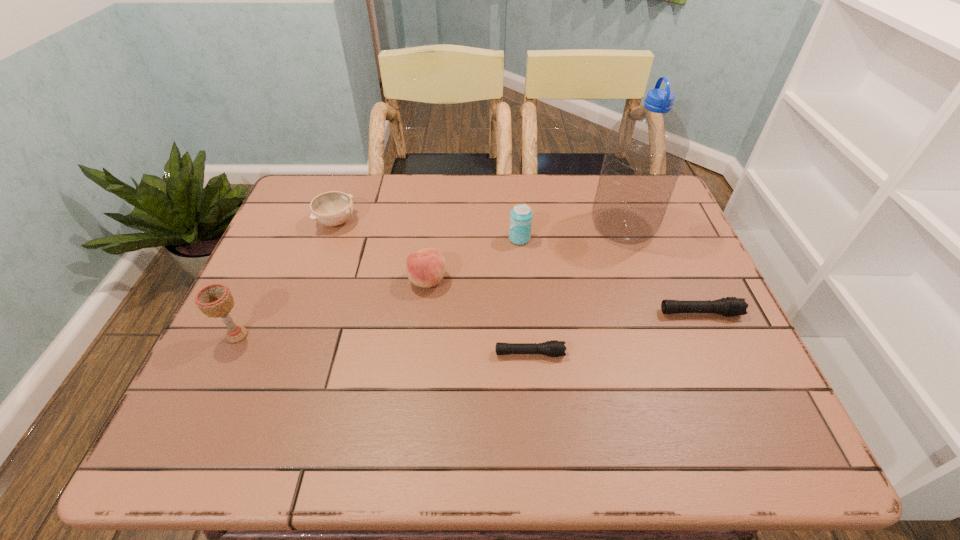
The height and width of the screenshot is (540, 960). I want to click on the fifth object from right to left, so click(x=425, y=268).

Locate an element on the screen. The height and width of the screenshot is (540, 960). the fourth farthest object is located at coordinates (425, 268).

Find the location of `free space located 0.360m at the lens end of the shortest object`. free space located 0.360m at the lens end of the shortest object is located at coordinates (730, 353).

I want to click on free location located on the front of the sixth object from right to left, so click(291, 348).

You are a GUI agent. You are given a task and a screenshot of the screen. Output one action in this format:
    pyautogui.click(x=<x>, y=<y>)
    Task: Click on the free space located 0.290m on the front of the beer can
    This screenshot has height=540, width=960.
    Given the screenshot: What is the action you would take?
    pyautogui.click(x=528, y=332)

What are the coordinates of `blank space located on the front of the water jug` in the screenshot? It's located at (641, 279).

This screenshot has width=960, height=540. I want to click on vacant space located on the front of the leftmost object, so click(x=221, y=371).

The width and height of the screenshot is (960, 540). In order to click on free space located on the front of the third object from left to right in this screenshot , I will do `click(424, 311)`.

Locate an element on the screen. The height and width of the screenshot is (540, 960). bowl present at the far edge is located at coordinates (333, 208).

Find the location of `water jug present at the far edge`. water jug present at the far edge is located at coordinates (646, 149).